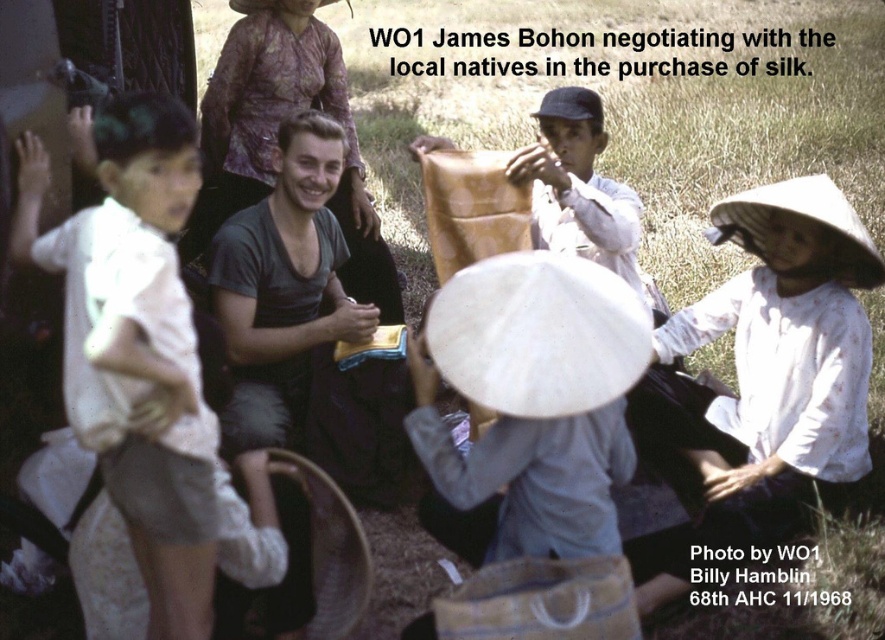
Which is behind, point (222, 157) or point (562, 116)?

Positioned behind is point (222, 157).

Between printed silk dress at upper center and light brown fabric at center, which one appears on the left side from the viewer's perspective?

Positioned to the left is printed silk dress at upper center.

Is point (337, 58) farther from viewer compared to point (533, 182)?

Yes, it is behind point (533, 182).

Where is `printed silk dress at upper center`? printed silk dress at upper center is located at coordinates (275, 134).

Consider the image. Does dark gray t-shirt at center have a greater height compared to light brown fabric at center?

Yes.

Can you confirm if dark gray t-shirt at center is wider than light brown fabric at center?

Incorrect, dark gray t-shirt at center's width does not surpass light brown fabric at center's.

Where is `dark gray t-shirt at center`? This screenshot has width=885, height=640. dark gray t-shirt at center is located at coordinates (283, 288).

Between white cotton shirt at left and dark gray t-shirt at center, which one has less height?

dark gray t-shirt at center

Which is below, white cotton shirt at left or dark gray t-shirt at center?

dark gray t-shirt at center is lower down.

Is point (119, 195) closer to camera compared to point (329, 269)?

Yes, point (119, 195) is in front of point (329, 269).

At what (x,y) coordinates should I click in order to perform the action: click on white cotton shirt at left. Please return your answer as a coordinate pair (x, y). Looking at the image, I should click on (136, 342).